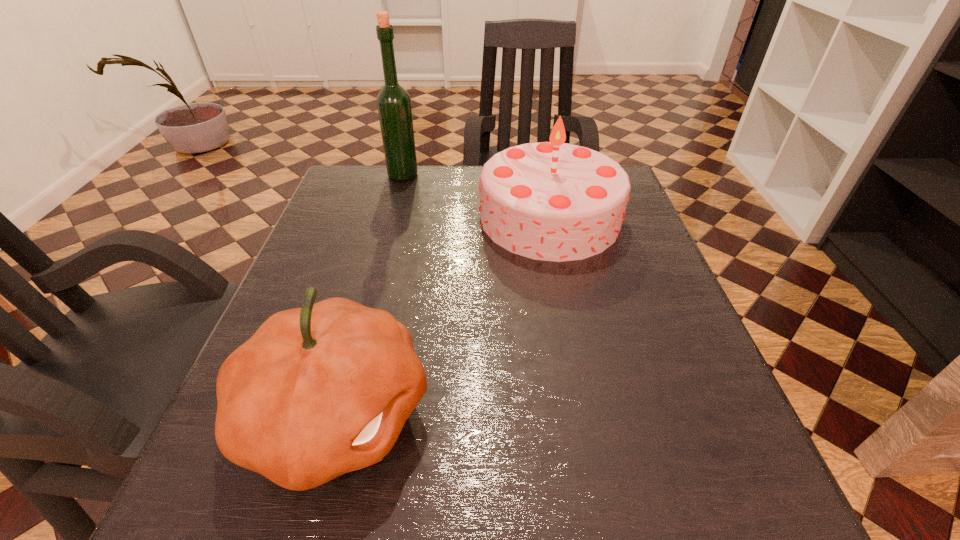
At what (x,y) coordinates should I click in order to perform the action: click on the tallest object. Please return your answer as a coordinate pair (x, y). Image resolution: width=960 pixels, height=540 pixels. Looking at the image, I should click on (393, 102).

The height and width of the screenshot is (540, 960). Identify the location of the rightmost object. [553, 201].

At what (x,y) coordinates should I click in order to perform the action: click on the shortest object. Please return your answer as a coordinate pair (x, y). This screenshot has width=960, height=540. Looking at the image, I should click on (318, 391).

In order to click on the nearest object in this screenshot , I will do `click(318, 391)`.

The width and height of the screenshot is (960, 540). Find the location of `vacant region located 0.180m on the right of the tallest object`. vacant region located 0.180m on the right of the tallest object is located at coordinates (486, 175).

Where is `free space located 0.220m on the left of the birthday cake`? free space located 0.220m on the left of the birthday cake is located at coordinates tap(384, 217).

What are the coordinates of `vacant space situated 0.390m on the front face of the nearest object` in the screenshot? It's located at (697, 414).

Where is `liquor that is at the far edge`? The height and width of the screenshot is (540, 960). liquor that is at the far edge is located at coordinates (393, 102).

Identify the location of birthday cake present at the far edge. The height and width of the screenshot is (540, 960). (553, 201).

I want to click on object at the near edge, so click(x=318, y=391).